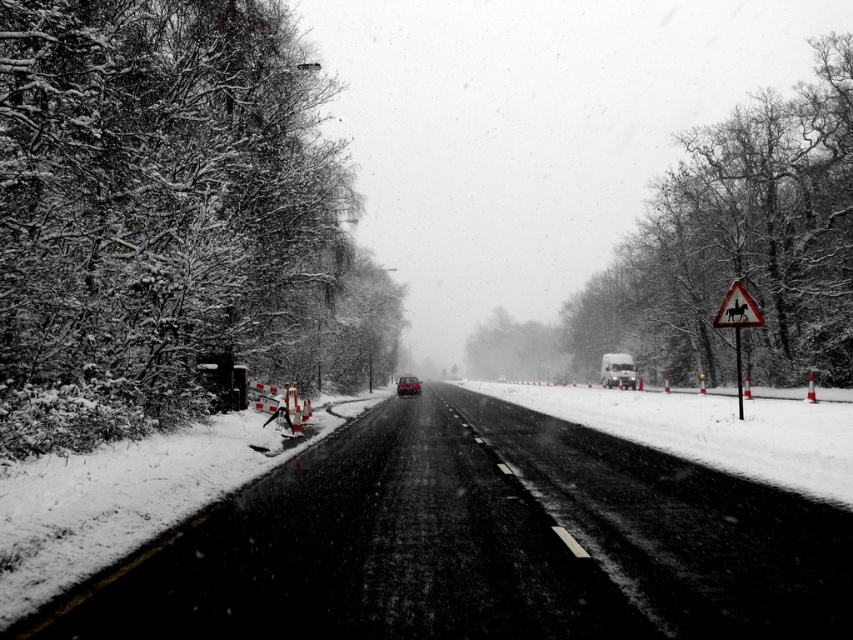
Which is above, snow-covered tree at right or shiny black car at center?

snow-covered tree at right is above.

Does snow-covered tree at right have a smaller size compared to shiny black car at center?

Actually, snow-covered tree at right might be larger than shiny black car at center.

In order to click on snow-covered tree at right in this screenshot , I will do `click(741, 241)`.

Where is `snow-covered tree at right`? The image size is (853, 640). snow-covered tree at right is located at coordinates (741, 241).

Does white powdery snow at road center appear on the right side of white plastic horse at right?

Yes, white powdery snow at road center is to the right of white plastic horse at right.

From the picture: Does white powdery snow at road center appear over white plastic horse at right?

Actually, white powdery snow at road center is below white plastic horse at right.

Who is more distant from viewer, [589,401] or [730,314]?

The point [589,401] is more distant.

The image size is (853, 640). What are the coordinates of `white powdery snow at road center` in the screenshot? It's located at (711, 429).

Is point (703, 224) positioned before point (558, 356)?

Yes.

Between snow-covered tree at right and green matte tree at center, which one appears on the left side from the viewer's perspective?

Positioned to the left is green matte tree at center.

Does point (648, 314) lie in front of point (525, 358)?

That is True.

Find the location of a particular element. This screenshot has width=853, height=640. snow-covered tree at right is located at coordinates (741, 241).